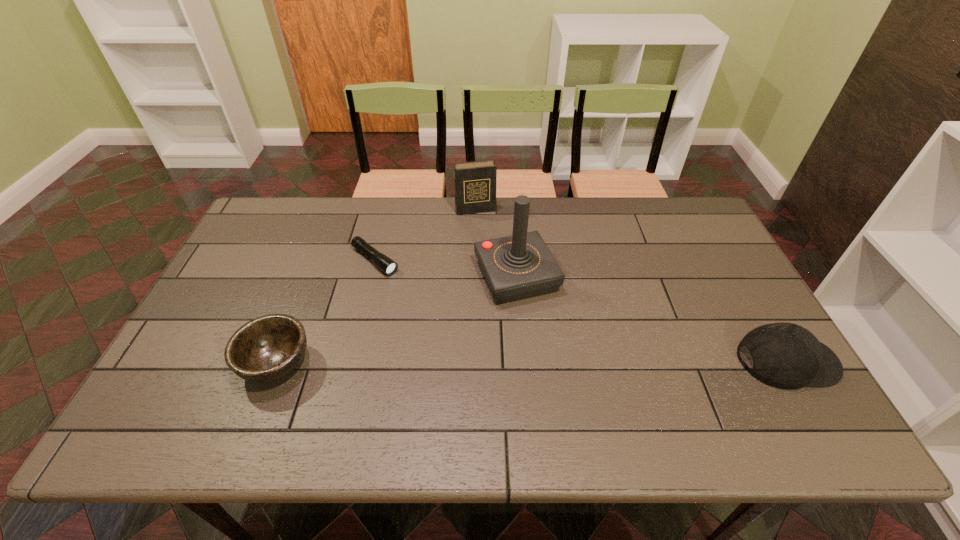
I want to click on free space on the desktop that is between the second shortest object and the third tallest object and is positioned at the lens end of the fourth object from right to left, so click(506, 362).

Find the location of `vacant space on the desktop that is between the bowl and the rightmost object and is positioned on the rectangular base of the joystick`. vacant space on the desktop that is between the bowl and the rightmost object and is positioned on the rectangular base of the joystick is located at coordinates (559, 362).

The width and height of the screenshot is (960, 540). I want to click on vacant space on the desktop that is between the leftmost object and the third shortest object and is positioned on the front cover of the fourth shortest object, so click(x=519, y=362).